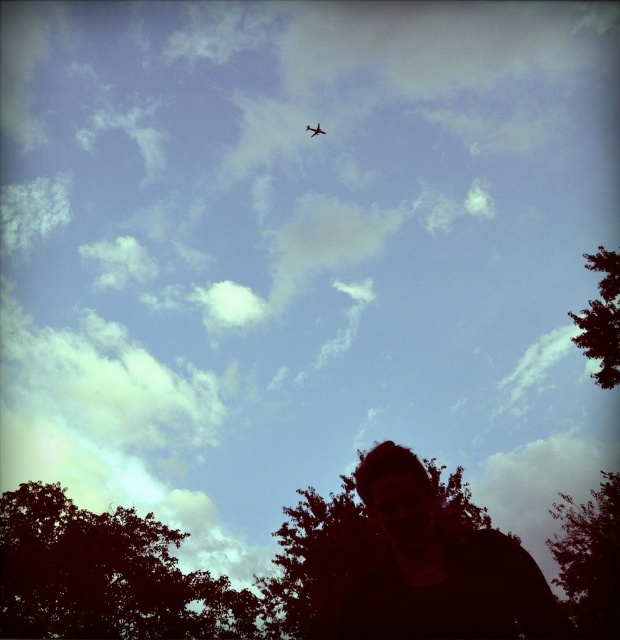
What are the coordinates of `dark green leafy tree at lower left` in the screenshot? It's located at (104, 576).

At what (x,y) coordinates should I click in order to perform the action: click on dark green leafy tree at lower left. Please return your answer as a coordinate pair (x, y). Image resolution: width=620 pixels, height=640 pixels. Looking at the image, I should click on (104, 576).

Is dark green leafy tree at lower right thinner than green leafy tree at upper right?

Incorrect, dark green leafy tree at lower right's width is not less than green leafy tree at upper right's.

Which is behind, point (598, 500) or point (603, 374)?

The point (598, 500) is more distant.

I want to click on dark green leafy tree at lower right, so click(x=590, y=557).

Consider the image. Does dark green leafy tree at lower right have a greater width compared to metallic airplane at upper center?

Yes, dark green leafy tree at lower right is wider than metallic airplane at upper center.

Which is behind, point (601, 544) or point (316, 125)?

Positioned behind is point (316, 125).

Identify the location of dark green leafy tree at lower right. (590, 557).

Find the location of a particular element. dark green leafy tree at lower right is located at coordinates (590, 557).